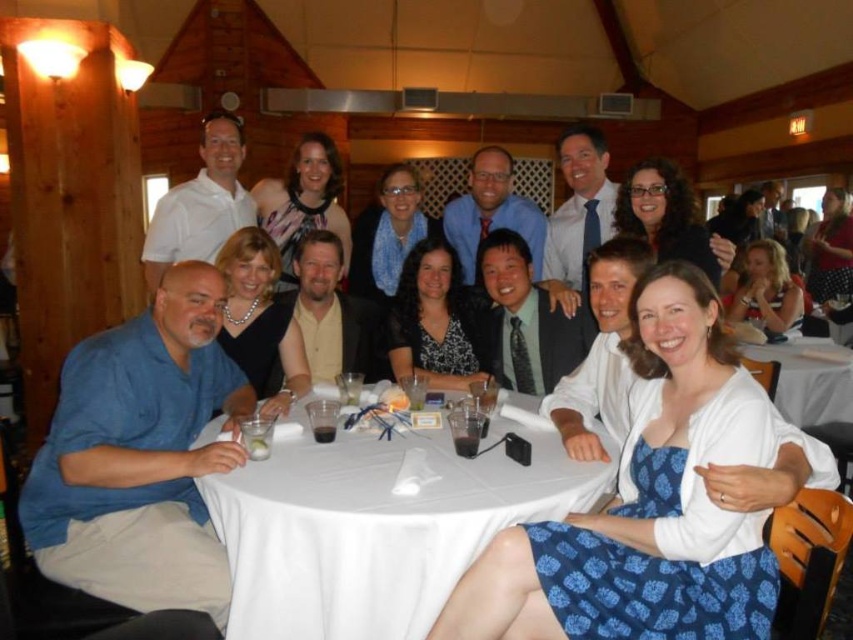
Between white cloth at center and white cloth at lower right, which one has more height?

white cloth at lower right

Does white cloth at center come in front of white cloth at lower right?

Yes, white cloth at center is in front of white cloth at lower right.

Identify the location of white cloth at center. The width and height of the screenshot is (853, 640). [375, 528].